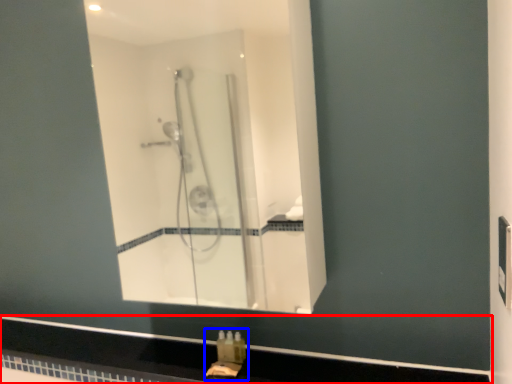
Question: Which object is further to the camera taking this photo, counter top (highlighted by a red box) or sink (highlighted by a blue box)?

Choices:
 (A) counter top
 (B) sink

Answer: (B)